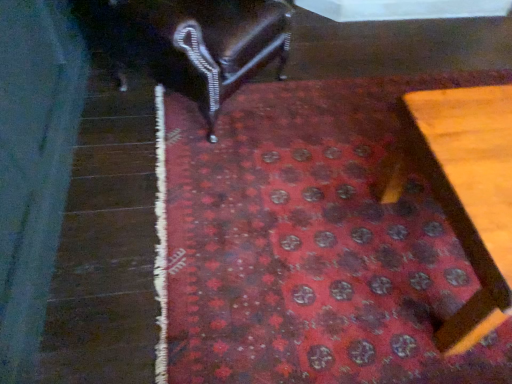
Where is `vacant space underneath shiny dark wood chair at upper left, positioned as the 2th furniture in right-to-left order (from a real-world perspective)`? The image size is (512, 384). vacant space underneath shiny dark wood chair at upper left, positioned as the 2th furniture in right-to-left order (from a real-world perspective) is located at coordinates (186, 107).